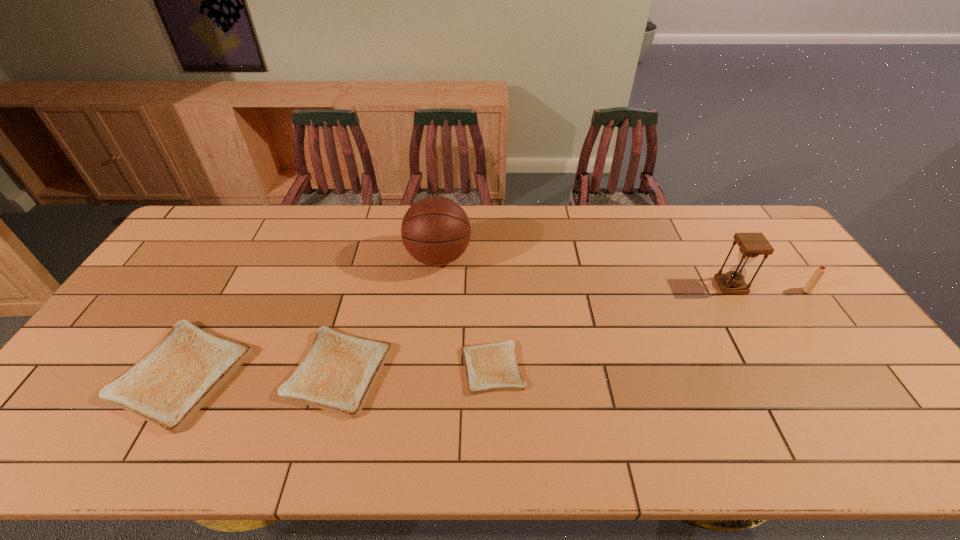
Where is `vacant space at the far edge of the desktop`? Image resolution: width=960 pixels, height=540 pixels. vacant space at the far edge of the desktop is located at coordinates (383, 214).

In the image, there is a desktop. Where is `blank space at the near edge`? This screenshot has width=960, height=540. blank space at the near edge is located at coordinates (544, 414).

The width and height of the screenshot is (960, 540). In order to click on vacant space at the left edge of the desktop in this screenshot , I will do `click(163, 264)`.

Where is `vacant space at the right edge`? The height and width of the screenshot is (540, 960). vacant space at the right edge is located at coordinates (815, 342).

Locate an element on the screen. free point between the fifth object from left to right and the igniter is located at coordinates (769, 288).

Locate an element on the screen. Image resolution: width=960 pixels, height=540 pixels. free spot between the third tallest object and the second tallest object is located at coordinates (769, 288).

Identify the location of free space between the second shortest toast and the shortest toast. This screenshot has height=540, width=960. (416, 369).

The height and width of the screenshot is (540, 960). Identify the location of vacant area between the second toast from left to right and the igniter. (573, 330).

Identify the location of unoccupied area between the igniter and the leftmost object. (494, 332).

You are a GUI agent. You are given a task and a screenshot of the screen. Output one action in this format:
    pyautogui.click(x=<x>, y=<y>)
    Task: Click on the vacant point located between the igniter and the hourglass
    This screenshot has height=540, width=960.
    Given the screenshot: What is the action you would take?
    pyautogui.click(x=769, y=288)